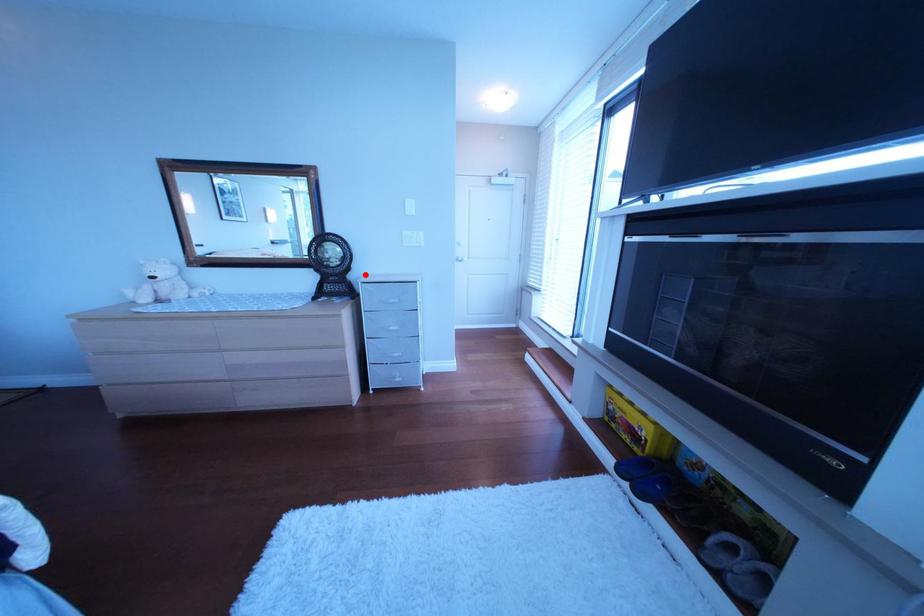
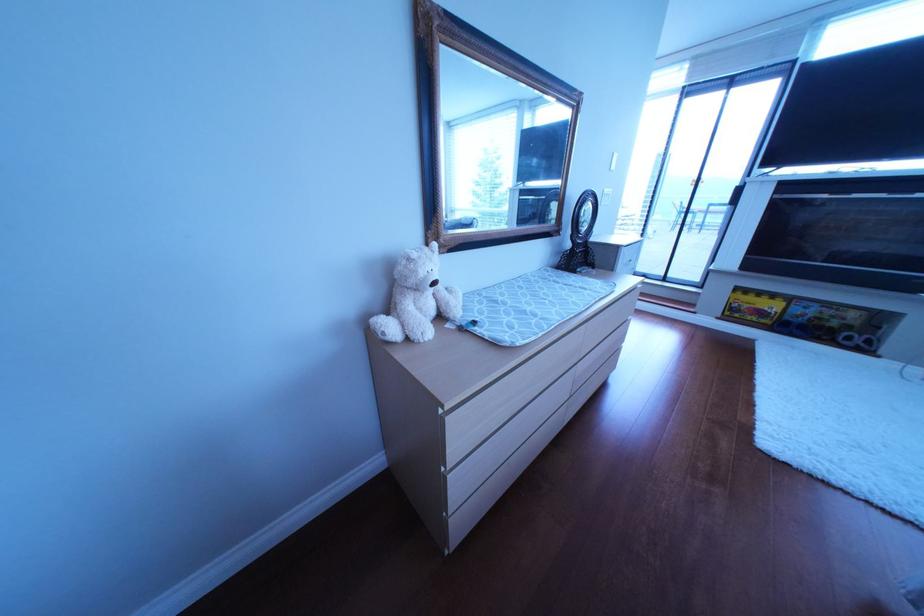
The point at the highlighted location is marked in the first image. Where is the corresponding point in the second image?

(605, 240)